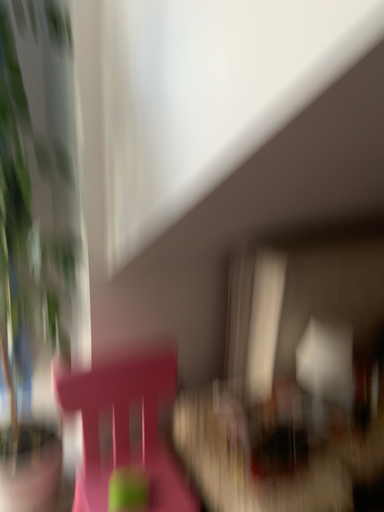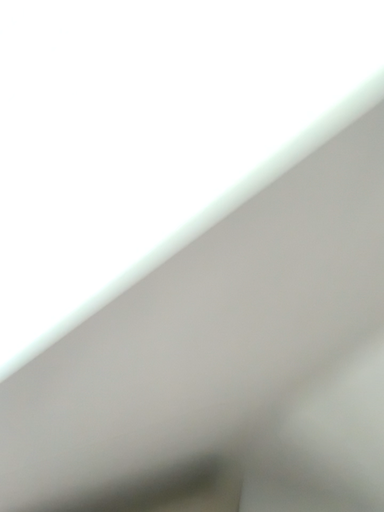
Question: How did the camera likely rotate when shooting the video?

Choices:
 (A) rotated upward
 (B) rotated downward

Answer: (A)